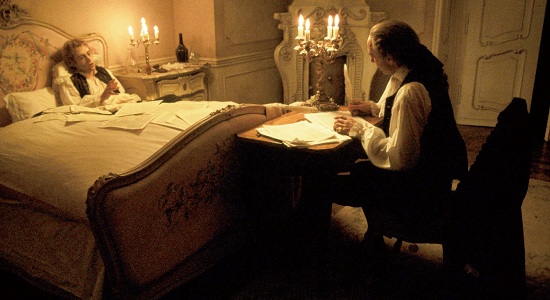
Locate an element on the screen. This screenshot has height=300, width=550. bed frame is located at coordinates (201, 185), (42, 57).